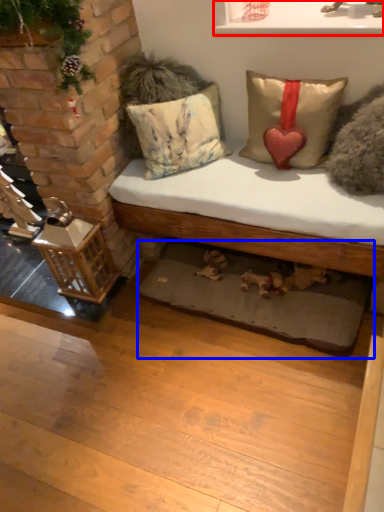
Question: Which of the following is the farthest to the observer, window sill (highlighted by a red box) or mat (highlighted by a blue box)?

Choices:
 (A) window sill
 (B) mat

Answer: (B)